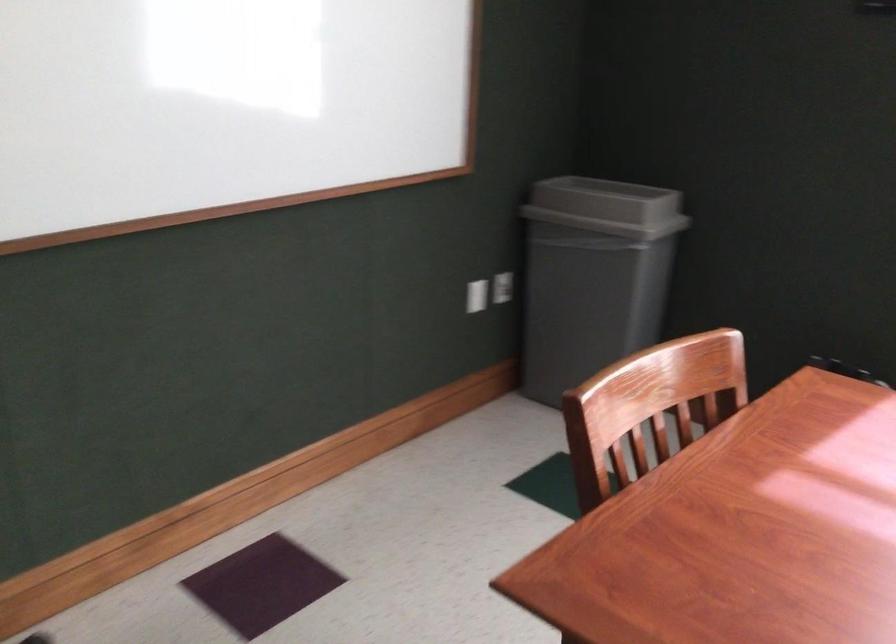
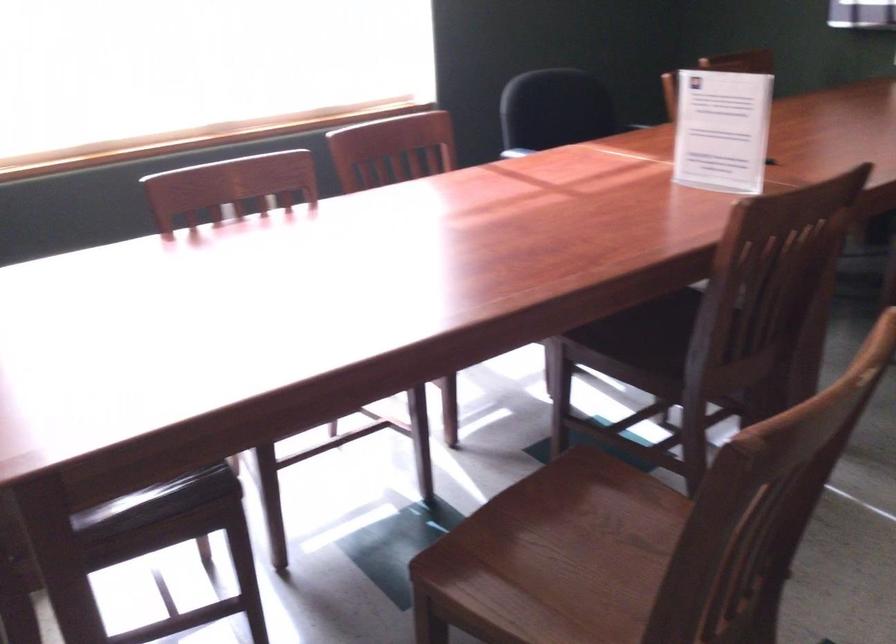
From the picture: The images are taken continuously from a first-person perspective. In which direction is your viewpoint rotating?

The camera's rotation is toward right-down.